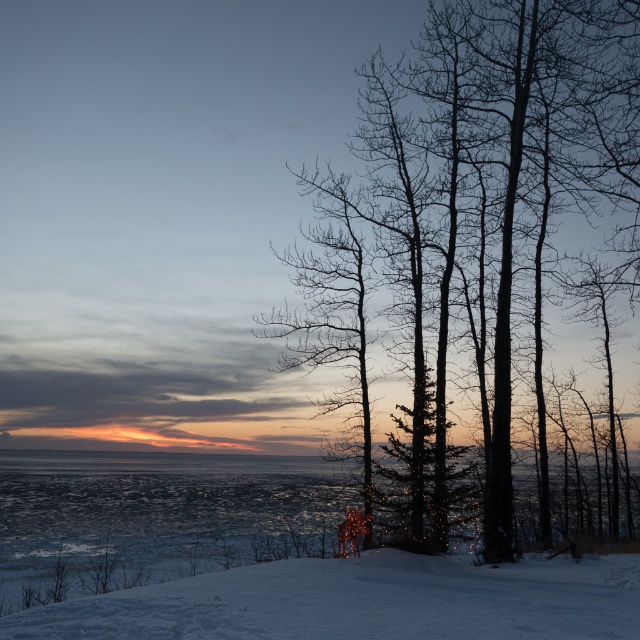
Between point (387, 77) and point (109, 624), which one is positioned in front?

Positioned in front is point (109, 624).

Is point (476, 51) closer to viewer compared to point (406, 561)?

No.

Describe the element at coordinates (499, 177) in the screenshot. I see `silhouette bare tree at right` at that location.

What are the coordinates of `silhouette bare tree at right` in the screenshot? It's located at (499, 177).